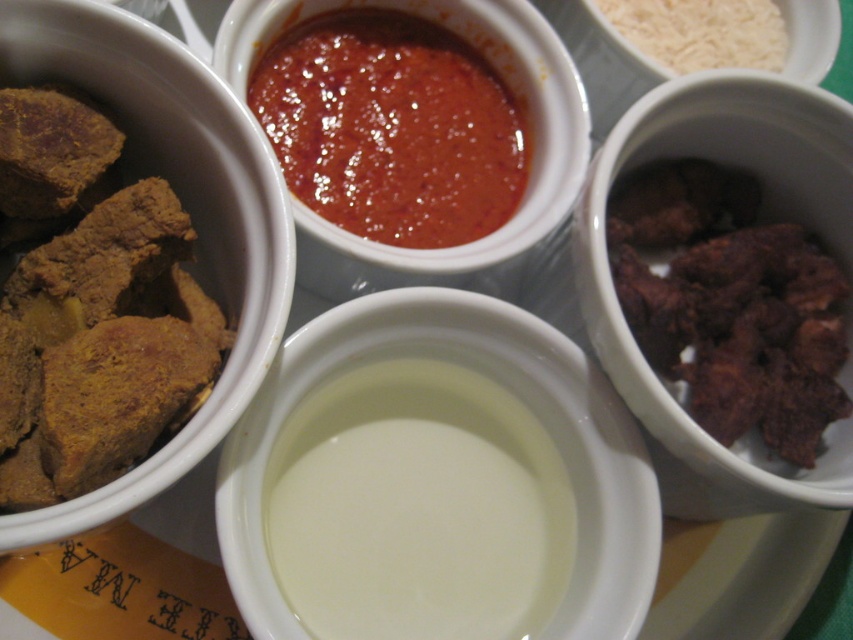
Question: Which of these objects is positioned farthest from the white glossy milk at center?

Choices:
 (A) dark brown crispy meat at right
 (B) white rice at upper right

Answer: (B)

Question: Is dark brown crispy meat at right positioned in front of white rice at upper right?

Choices:
 (A) yes
 (B) no

Answer: (A)

Question: Which of the following is the closest to the observer?

Choices:
 (A) (579, 76)
 (B) (300, 467)
 (C) (706, 12)
 (D) (64, 321)

Answer: (D)

Question: Can you confirm if brown crumbly bread at left is bigger than dark brown crispy meat at right?

Choices:
 (A) yes
 (B) no

Answer: (B)

Question: Can you confirm if brown crumbly bread at left is positioned above dark brown crispy meat at right?

Choices:
 (A) yes
 (B) no

Answer: (A)

Question: Among these objects, which one is nearest to the camera?

Choices:
 (A) white rice at upper right
 (B) dark brown crispy meat at right
 (C) white glossy milk at center
 (D) brown crumbly bread at left

Answer: (D)